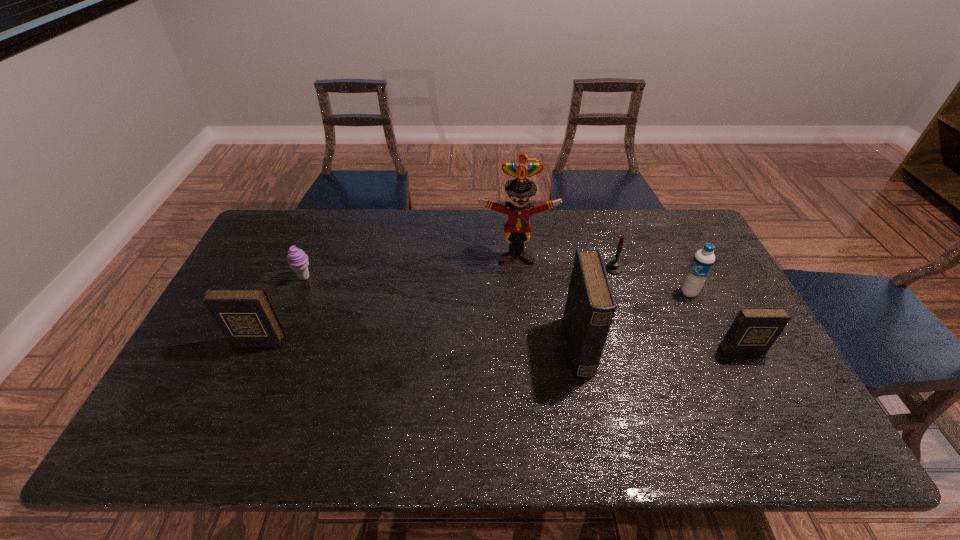
You are a GUI agent. You are given a task and a screenshot of the screen. Output one action in this format:
    pyautogui.click(x=<x>, y=<y>)
    Task: Click on the free space for an extra diary to achieve even spacing
    
    Given the screenshot: What is the action you would take?
    pyautogui.click(x=418, y=344)